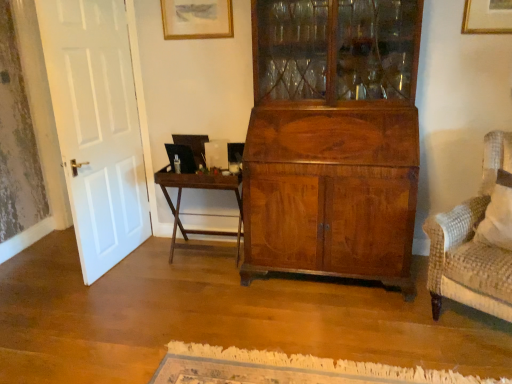
Question: Looking at their shapes, would you say dark brown wood table at center is wider or thinner than matte gold picture frame at upper center?

Choices:
 (A) thin
 (B) wide

Answer: (B)

Question: In terms of size, does dark brown wood table at center appear bigger or smaller than matte gold picture frame at upper center?

Choices:
 (A) big
 (B) small

Answer: (A)

Question: In the image, is dark brown wood table at center positioned in front of or behind matte gold picture frame at upper center?

Choices:
 (A) front
 (B) behind

Answer: (A)

Question: Considering the relative positions of matte gold picture frame at upper center and dark brown wood table at center in the image provided, is matte gold picture frame at upper center to the left or to the right of dark brown wood table at center?

Choices:
 (A) left
 (B) right

Answer: (A)

Question: From the image's perspective, is matte gold picture frame at upper center above or below dark brown wood table at center?

Choices:
 (A) above
 (B) below

Answer: (A)

Question: From a real-world perspective, is matte gold picture frame at upper center positioned above or below dark brown wood table at center?

Choices:
 (A) below
 (B) above

Answer: (B)

Question: Relative to dark brown wood table at center, is matte gold picture frame at upper center in front or behind?

Choices:
 (A) behind
 (B) front

Answer: (A)